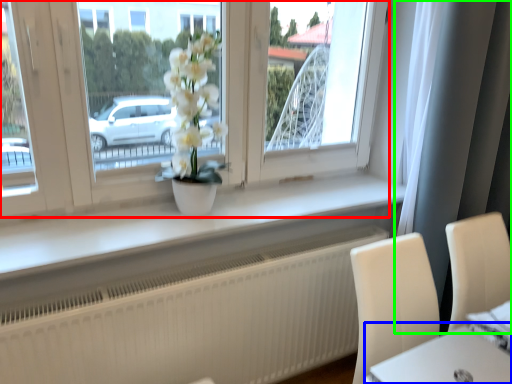
Question: Based on their relative distances, which object is farther from window (highlighted by a red box)? Choose from round table (highlighted by a blue box) and curtain (highlighted by a green box).

Choices:
 (A) round table
 (B) curtain

Answer: (A)